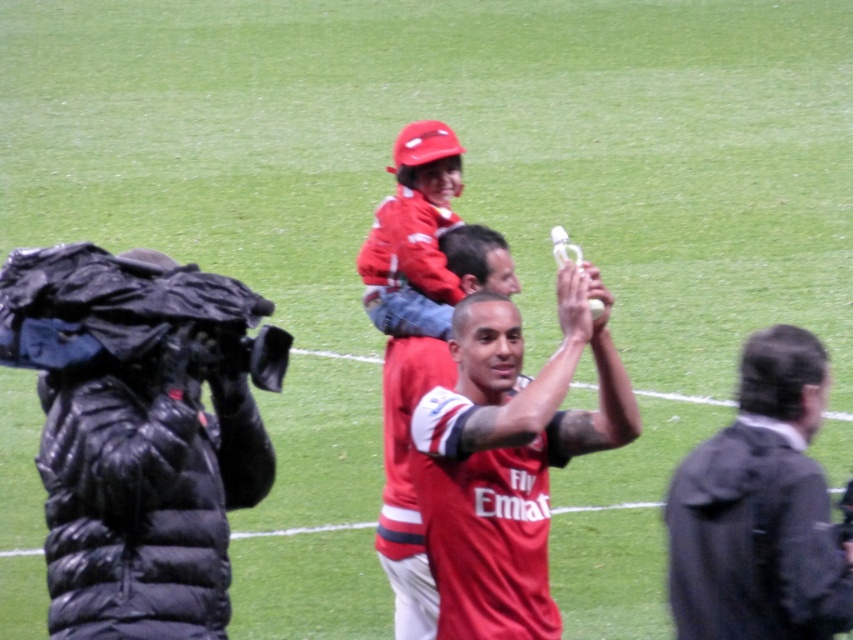
Question: Does black puffer jacket at left have a smaller size compared to red jersey at center?

Choices:
 (A) no
 (B) yes

Answer: (A)

Question: Is black puffer jacket at left bigger than matte red jersey at center?

Choices:
 (A) no
 (B) yes

Answer: (B)

Question: Which is nearer to the red jersey at center?

Choices:
 (A) black puffer jacket at left
 (B) matte red jersey at center
 (C) matte red helmet at upper center
 (D) dark gray jacket at right

Answer: (D)

Question: Can you confirm if black puffer jacket at left is bigger than matte red helmet at upper center?

Choices:
 (A) no
 (B) yes

Answer: (B)

Question: Which is farther from the matte red helmet at upper center?

Choices:
 (A) matte red jersey at center
 (B) red jersey at center
 (C) dark gray jacket at right

Answer: (C)

Question: Which point is closer to the camera?

Choices:
 (A) black puffer jacket at left
 (B) matte red helmet at upper center

Answer: (A)